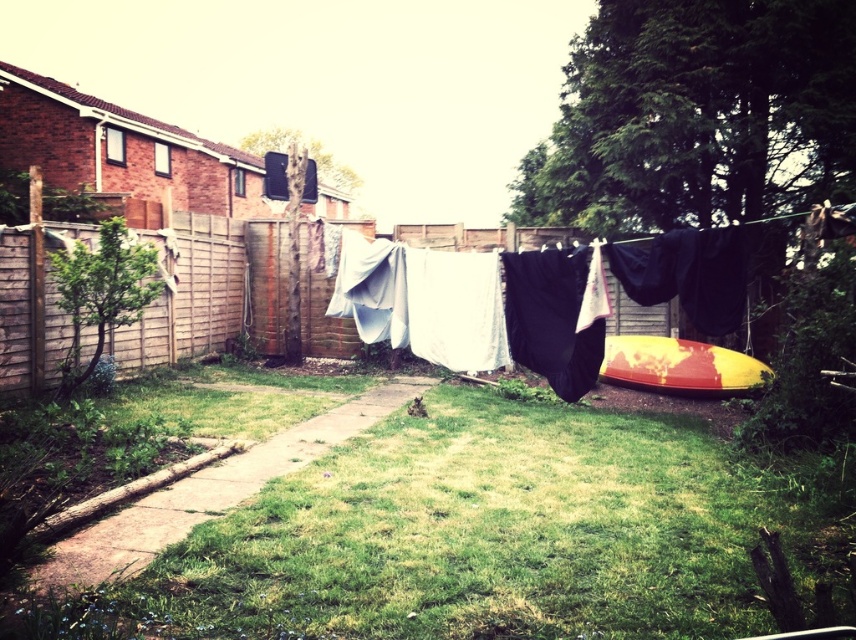
You are standing at the point marked as point (x=352, y=307). You want to hang a large bedsheet that requires 8 meters of space between two points. Can you use the existing clothesline between the two points to hang it?

The distance between the two points is 7.72 meters, which is slightly less than the required 8 meters. Therefore, the bedsheet cannot be fully stretched on the existing clothesline between the two points.